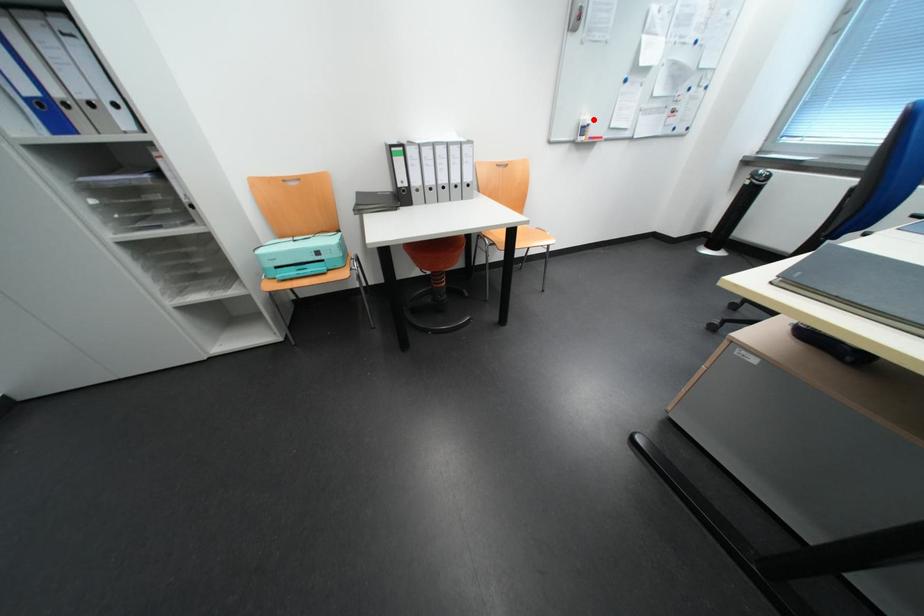
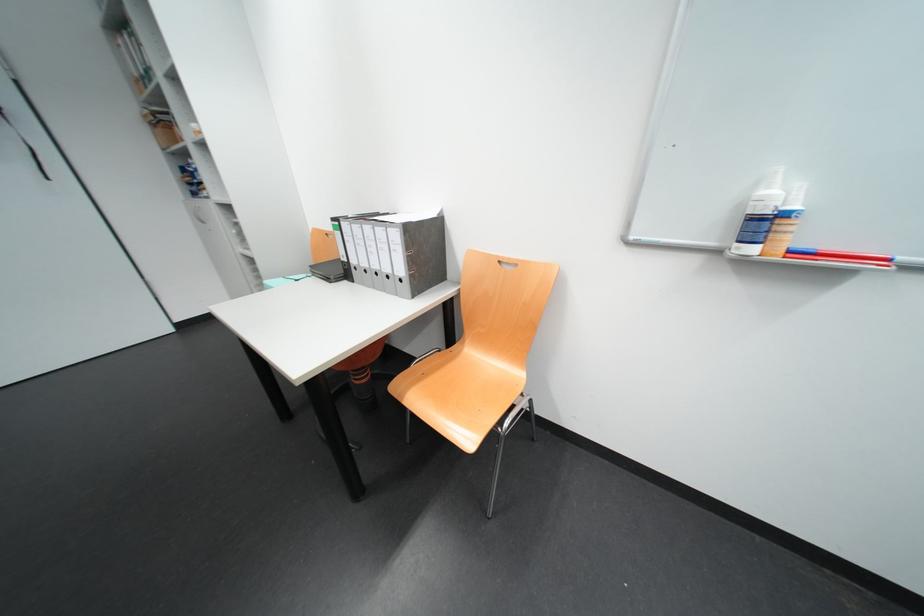
Question: I am providing you with two images of the same scene from different viewpoints. Given a red point in image1, look at the same physical point in image2. Is it:

Choices:
 (A) Closer to the viewpoint
 (B) Farther from the viewpoint

Answer: (B)